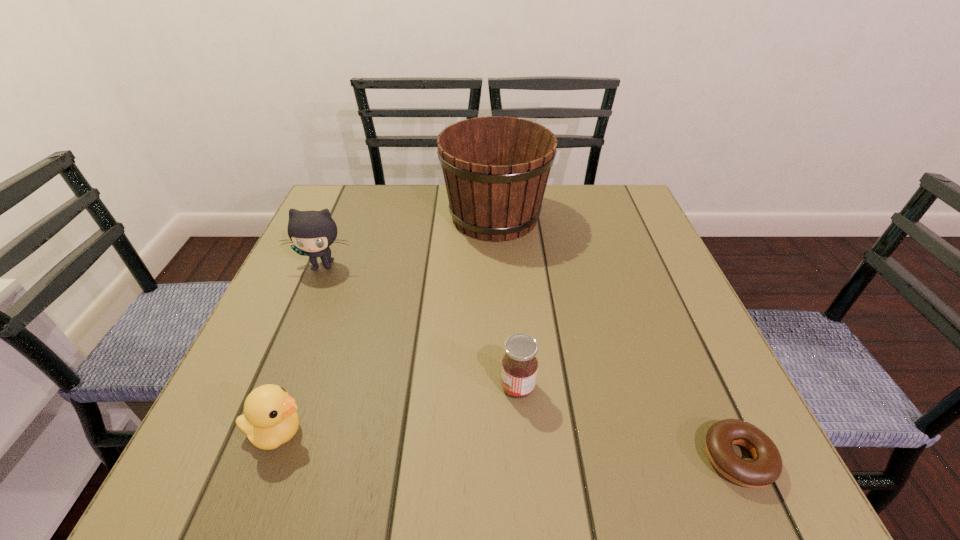
Where is `vacant space situated 0.160m on the label side of the jam`? vacant space situated 0.160m on the label side of the jam is located at coordinates (406, 387).

Locate an element on the screen. vacant area situated 0.230m on the label side of the jam is located at coordinates 364,387.

Identify the location of free spot located 0.200m on the label side of the jam. This screenshot has width=960, height=540. (382, 387).

The width and height of the screenshot is (960, 540). I want to click on vacant space located on the face of the duck, so click(541, 433).

In order to click on free space located on the back of the shortest object in this screenshot , I will do `click(689, 353)`.

At what (x,y) coordinates should I click in order to perform the action: click on object that is at the far edge. Please return your answer as a coordinate pair (x, y). Looking at the image, I should click on coord(496,169).

Where is `duck located at the near edge`? This screenshot has width=960, height=540. duck located at the near edge is located at coordinates (270, 418).

Identify the location of doughnut positioned at the near edge. (766, 468).

Where is `kitten that is at the left edge`? kitten that is at the left edge is located at coordinates (312, 232).

Find the location of a particular element. This screenshot has height=540, width=960. duck present at the left edge is located at coordinates click(x=270, y=418).